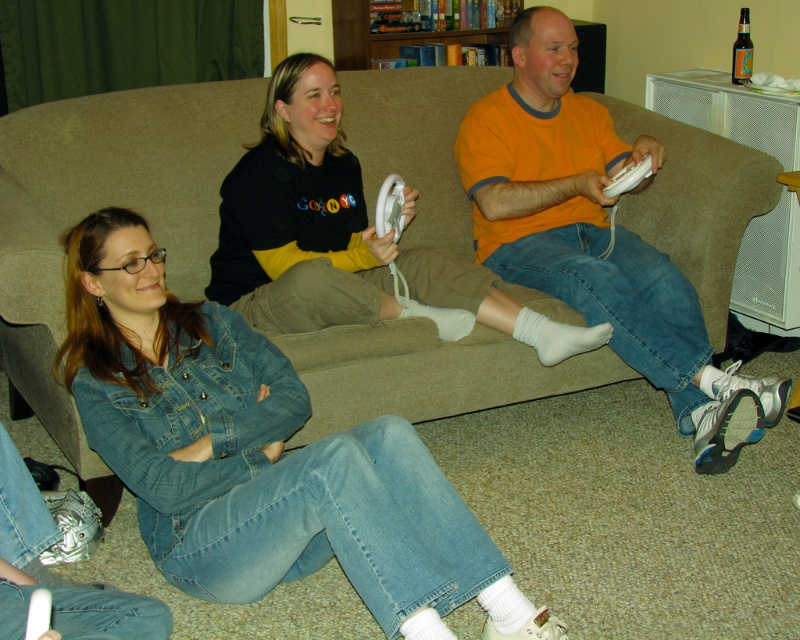
You are a game developer observing the Wii gaming session. You need to place a new game cartridge onto the beige fabric couch at center so it is closer to the white matte controller at center right than the couch itself. Is this possible given their current positions?

The beige fabric couch at center is positioned on the left side of the white matte controller at center right. Since the couch is to the left of the controller, placing the cartridge on the couch closer to the controller would require positioning it towards the right side of the couch, which is adjacent to the controller. This placement is feasible as the couch and controller are aligned horizontally with the couch on the left.

You are a photographer trying to capture a candid shot of the gaming session. You notice the orange cotton shirt at center and the white matte controller at center right. Which object should you focus on first if you want to capture both in a single frame without moving the camera?

You should focus on the orange cotton shirt at center first because it is located below the white matte controller at center right, so adjusting focus from the lower position upwards can help capture both in the frame.

You are a photographer trying to capture a closeup of the white matte controller at center right without including the orange cotton shirt at center in the frame. Is this possible based on their positions?

The orange cotton shirt at center is in front of the white matte controller at center right, so it would block the view. Therefore, capturing a closeup of the white matte controller at center right without the orange cotton shirt at center is not possible.